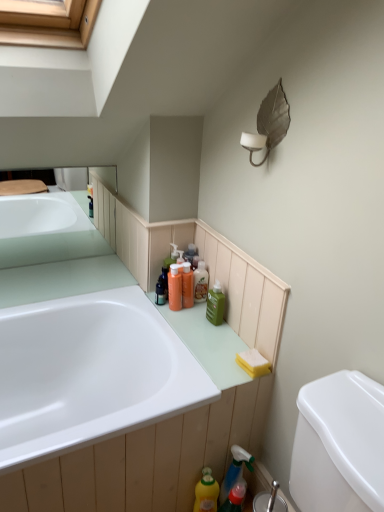
Locate an element on the screen. The width and height of the screenshot is (384, 512). vacant space that is in between yellow sponge at lower right and orange plastic bottles at center, which is the first toiletry from left to right is located at coordinates 215,334.